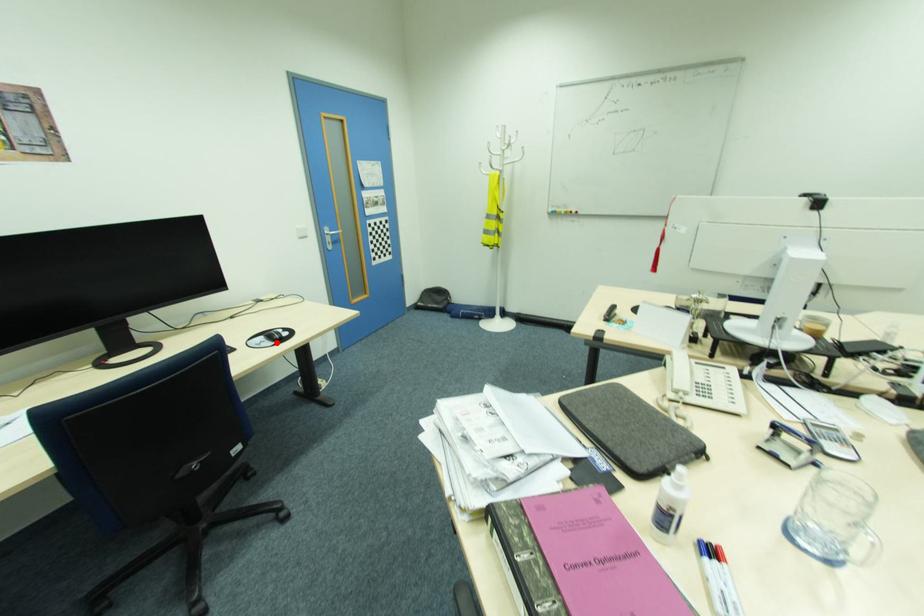
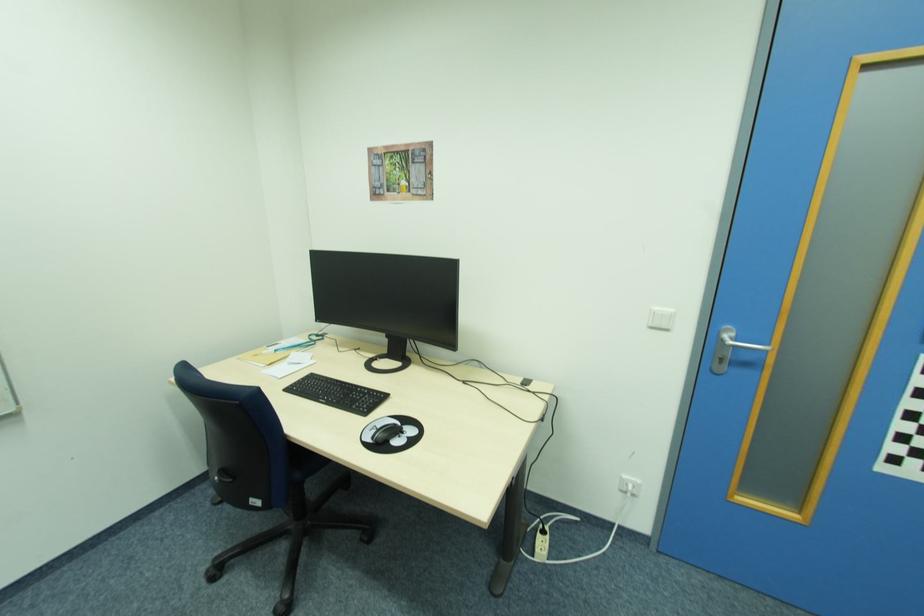
In the second image, find the point that corresponds to the highlighted location in the first image.

(372, 440)